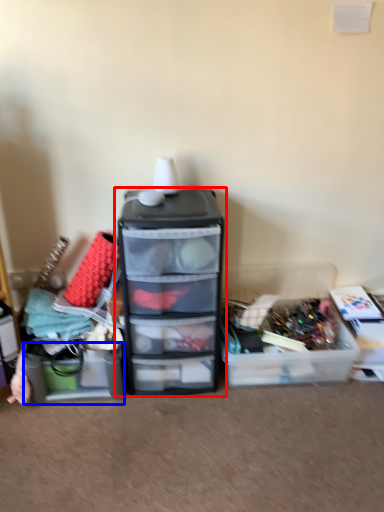
Question: Which point is closer to the camera, furniture (highlighted by a red box) or storage box (highlighted by a blue box)?

Choices:
 (A) furniture
 (B) storage box

Answer: (A)